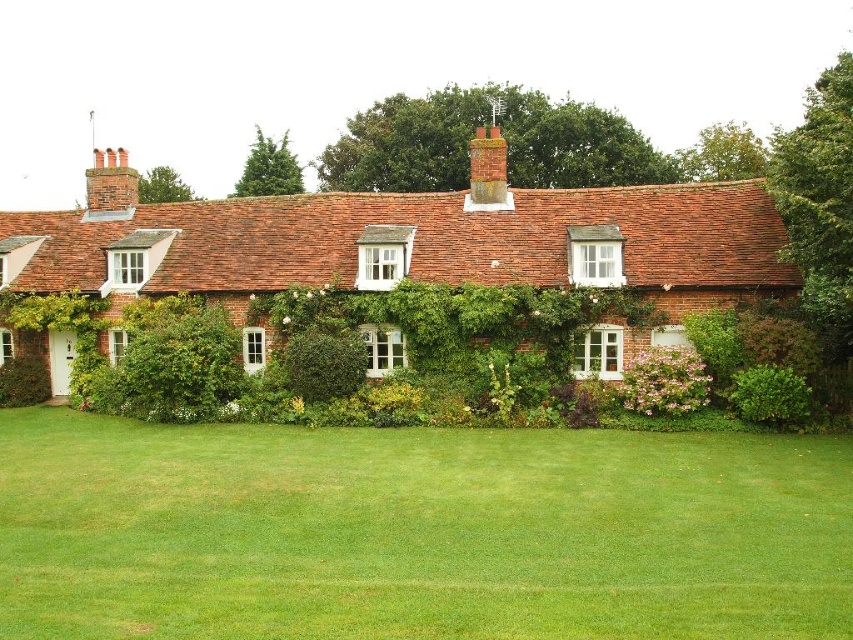
Question: Can you confirm if green grass at lower center is positioned to the left of green leafy hedge at lower left?

Choices:
 (A) yes
 (B) no

Answer: (B)

Question: Which point is closer to the camera taking this photo?

Choices:
 (A) (233, 397)
 (B) (172, 216)

Answer: (A)

Question: Which of the following is the closest to the observer?

Choices:
 (A) (222, 326)
 (B) (355, 588)
 (C) (604, 224)

Answer: (B)

Question: Estimate the real-world distances between objects in this image. Which object is closer to the green leafy hedge at center?

Choices:
 (A) green leafy hedge at lower left
 (B) green grass at lower center
 (C) red brick cottage at center

Answer: (A)

Question: Can you confirm if green grass at lower center is bigger than green leafy hedge at lower right?

Choices:
 (A) no
 (B) yes

Answer: (B)

Question: Does red brick cottage at center appear under green leafy hedge at lower right?

Choices:
 (A) yes
 (B) no

Answer: (B)